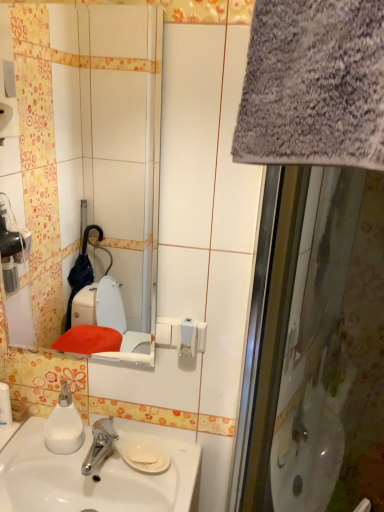
Question: Would you say gray fabric screen door at right contains white glossy sink at lower left?

Choices:
 (A) no
 (B) yes

Answer: (A)

Question: From a real-world perspective, does gray fabric screen door at right stand above white glossy sink at lower left?

Choices:
 (A) no
 (B) yes

Answer: (B)

Question: Does gray fabric screen door at right come in front of white glossy sink at lower left?

Choices:
 (A) no
 (B) yes

Answer: (B)

Question: From the image's perspective, would you say gray fabric screen door at right is shown under white glossy sink at lower left?

Choices:
 (A) yes
 (B) no

Answer: (B)

Question: Can you confirm if gray fabric screen door at right is positioned to the right of white glossy sink at lower left?

Choices:
 (A) no
 (B) yes

Answer: (B)

Question: Is white glossy sink at lower left situated inside white matte soap dispenser at lower left or outside?

Choices:
 (A) inside
 (B) outside

Answer: (B)

Question: Is point (89, 441) closer or farther from the camera than point (62, 410)?

Choices:
 (A) closer
 (B) farther

Answer: (B)

Question: Relative to white matte soap dispenser at lower left, is white glossy sink at lower left in front or behind?

Choices:
 (A) behind
 (B) front

Answer: (B)

Question: Is white glossy sink at lower left wider or thinner than white matte soap dispenser at lower left?

Choices:
 (A) wide
 (B) thin

Answer: (A)

Question: From the image's perspective, is white glossy sink at lower left located above or below white glossy mirror at upper center?

Choices:
 (A) above
 (B) below

Answer: (B)

Question: Is point (48, 509) closer or farther from the camera than point (79, 123)?

Choices:
 (A) farther
 (B) closer

Answer: (B)

Question: Is white glossy sink at lower left in front of or behind white glossy mirror at upper center in the image?

Choices:
 (A) front
 (B) behind

Answer: (B)

Question: Based on their sizes in the image, would you say white glossy sink at lower left is bigger or smaller than white glossy mirror at upper center?

Choices:
 (A) big
 (B) small

Answer: (A)

Question: In terms of height, does white glossy sink at lower left look taller or shorter compared to gray fabric screen door at right?

Choices:
 (A) short
 (B) tall

Answer: (A)

Question: Do you think white glossy sink at lower left is within gray fabric screen door at right, or outside of it?

Choices:
 (A) outside
 (B) inside

Answer: (A)